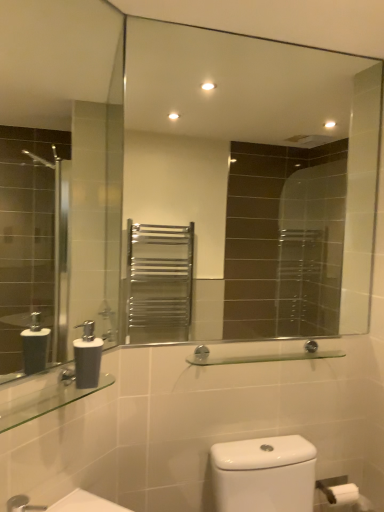
Question: From a real-world perspective, is matte gray soap dispenser at lower left physically above clear glass shelf at lower left, marked as the 2th balustrade in a back-to-front arrangement?

Choices:
 (A) yes
 (B) no

Answer: (A)

Question: Considering the relative sizes of matte gray soap dispenser at lower left and clear glass shelf at lower left, arranged as the 1th balustrade when viewed from the front, in the image provided, is matte gray soap dispenser at lower left bigger than clear glass shelf at lower left, arranged as the 1th balustrade when viewed from the front,?

Choices:
 (A) yes
 (B) no

Answer: (B)

Question: Is matte gray soap dispenser at lower left turned away from clear glass shelf at lower left, the 1th balustrade in the left-to-right sequence?

Choices:
 (A) no
 (B) yes

Answer: (A)

Question: Is matte gray soap dispenser at lower left at the left side of clear glass shelf at lower left, which is counted as the 2th balustrade, starting from the right?

Choices:
 (A) yes
 (B) no

Answer: (B)

Question: Can you confirm if matte gray soap dispenser at lower left is taller than clear glass shelf at lower left, the 1th balustrade in the left-to-right sequence?

Choices:
 (A) no
 (B) yes

Answer: (B)

Question: From the image's perspective, is clear glass shelf at lower left, marked as the 2th balustrade in a back-to-front arrangement, above or below clear glass shelf at center, the first balustrade viewed from the back?

Choices:
 (A) above
 (B) below

Answer: (B)

Question: Is point (18, 418) positioned closer to the camera than point (317, 354)?

Choices:
 (A) closer
 (B) farther

Answer: (A)

Question: Is clear glass shelf at lower left, arranged as the 1th balustrade when viewed from the front, inside the boundaries of clear glass shelf at center, arranged as the 1th balustrade when viewed from the right, or outside?

Choices:
 (A) inside
 (B) outside

Answer: (B)

Question: Considering the positions of clear glass shelf at lower left, which is counted as the 2th balustrade, starting from the right, and clear glass shelf at center, which ranks as the 2th balustrade in front-to-back order, in the image, is clear glass shelf at lower left, which is counted as the 2th balustrade, starting from the right, taller or shorter than clear glass shelf at center, which ranks as the 2th balustrade in front-to-back order,?

Choices:
 (A) short
 (B) tall

Answer: (A)

Question: Considering the positions of clear glass shelf at center, the first balustrade viewed from the back, and clear glass shelf at lower left, arranged as the 1th balustrade when viewed from the front, in the image, is clear glass shelf at center, the first balustrade viewed from the back, bigger or smaller than clear glass shelf at lower left, arranged as the 1th balustrade when viewed from the front,?

Choices:
 (A) big
 (B) small

Answer: (A)

Question: Choose the correct answer: Is clear glass shelf at center, arranged as the 1th balustrade when viewed from the right, inside clear glass shelf at lower left, which is counted as the 2th balustrade, starting from the right, or outside it?

Choices:
 (A) inside
 (B) outside

Answer: (B)

Question: Would you say clear glass shelf at center, which ranks as the 2th balustrade in front-to-back order, is to the left or to the right of clear glass shelf at lower left, marked as the 2th balustrade in a back-to-front arrangement, in the picture?

Choices:
 (A) right
 (B) left

Answer: (A)

Question: From their relative heights in the image, would you say clear glass shelf at center, the first balustrade viewed from the back, is taller or shorter than clear glass shelf at lower left, which is counted as the 2th balustrade, starting from the right?

Choices:
 (A) tall
 (B) short

Answer: (A)

Question: From a real-world perspective, is matte gray soap dispenser at lower left positioned above or below clear glass shelf at lower left, which is counted as the 2th balustrade, starting from the right?

Choices:
 (A) below
 (B) above

Answer: (B)

Question: Based on their positions, is matte gray soap dispenser at lower left located to the left or right of clear glass shelf at lower left, which is counted as the 2th balustrade, starting from the right?

Choices:
 (A) right
 (B) left

Answer: (A)